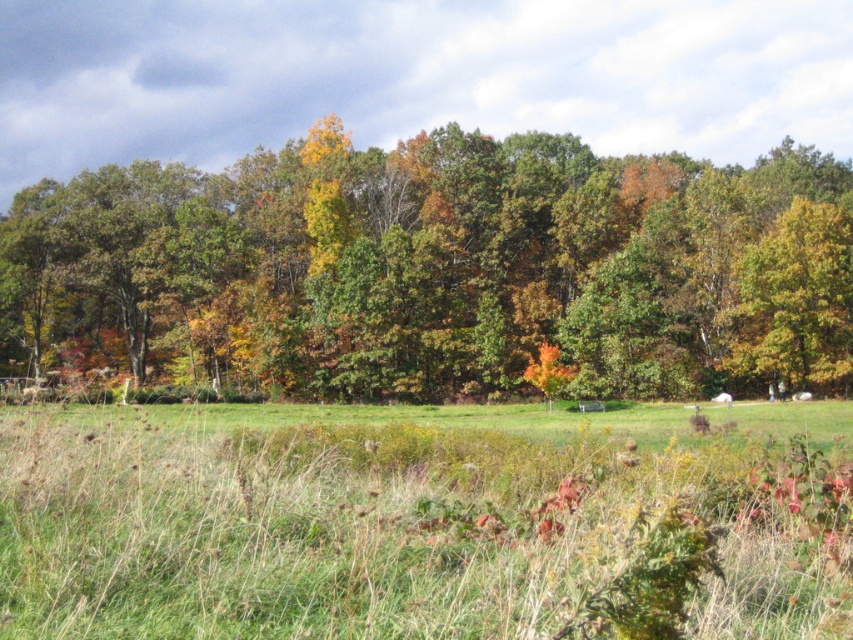
Does green matte tree at upper center appear over green grass at center?

Correct, green matte tree at upper center is located above green grass at center.

Based on the photo, which is more to the right, green matte tree at upper center or green grass at center?

green grass at center is more to the right.

Between point (160, 374) and point (537, 492), which one is positioned behind?

Positioned behind is point (160, 374).

Where is `green matte tree at upper center`? This screenshot has width=853, height=640. green matte tree at upper center is located at coordinates (437, 269).